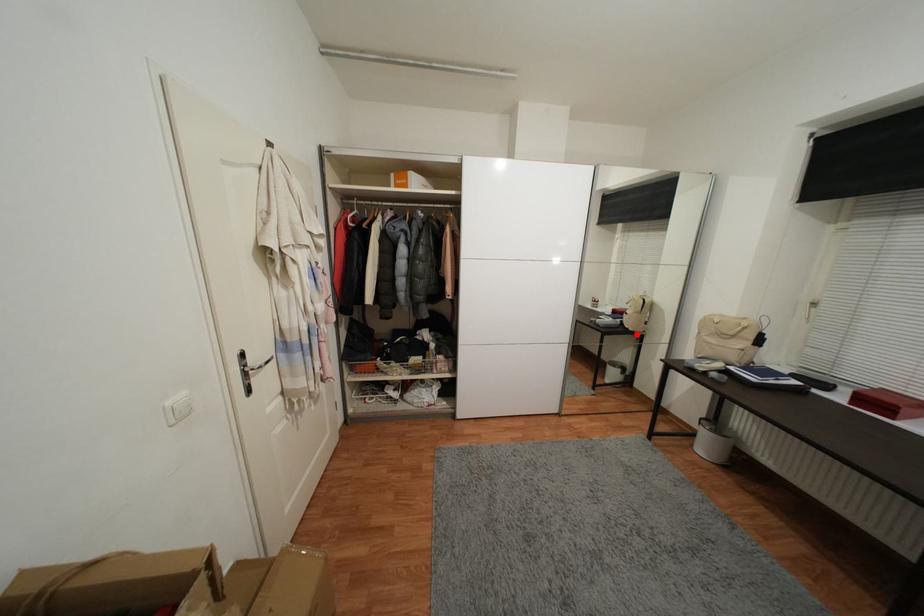
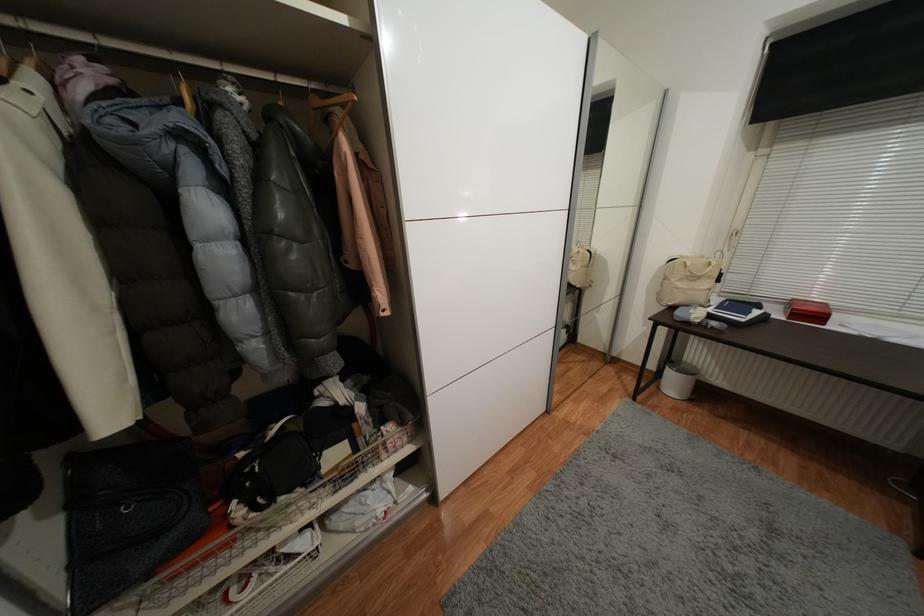
The point at the highlighted location is marked in the first image. Where is the corresponding point in the second image?

(582, 291)